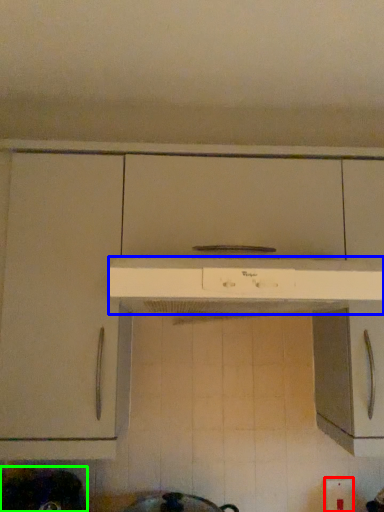
Question: Estimate the real-world distances between objects in this image. Which object is closer to electric outlet (highlighted by a red box), home appliance (highlighted by a blue box) or appliance (highlighted by a green box)?

Choices:
 (A) home appliance
 (B) appliance

Answer: (A)